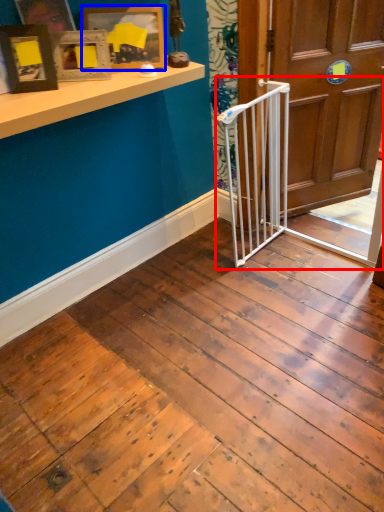
Question: Which point is further to the camera, rail (highlighted by a red box) or picture frame (highlighted by a blue box)?

Choices:
 (A) rail
 (B) picture frame

Answer: (B)